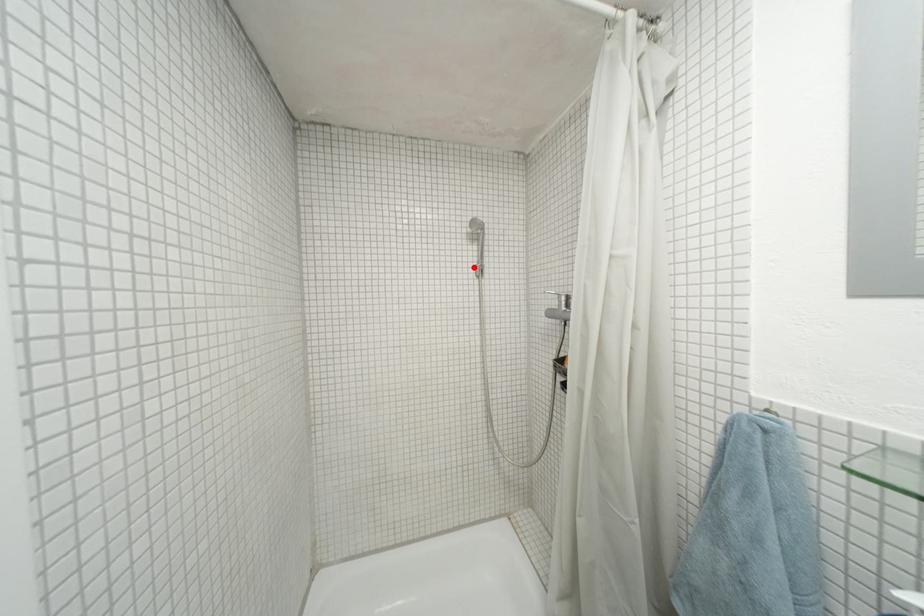
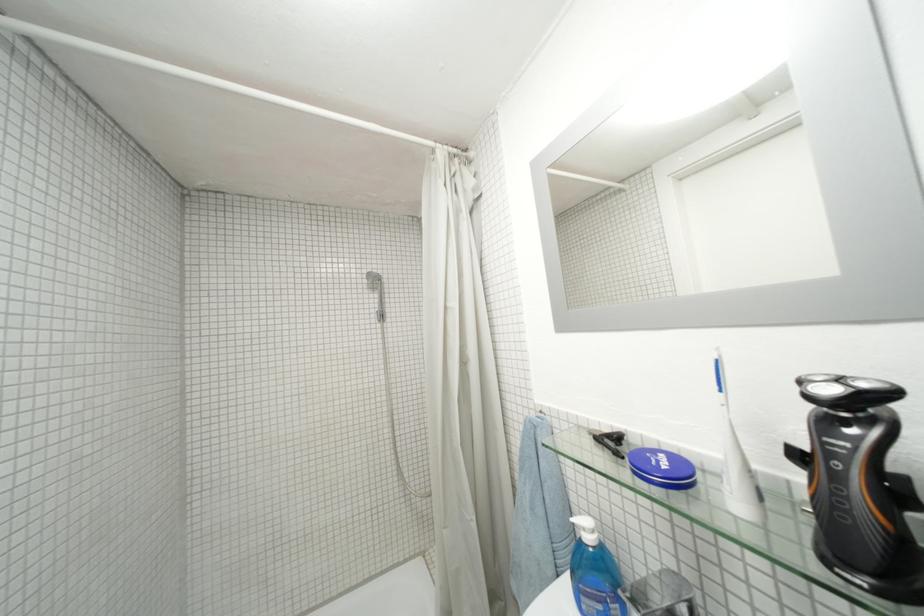
In the second image, find the point that corresponds to the highlighted location in the first image.

(375, 314)